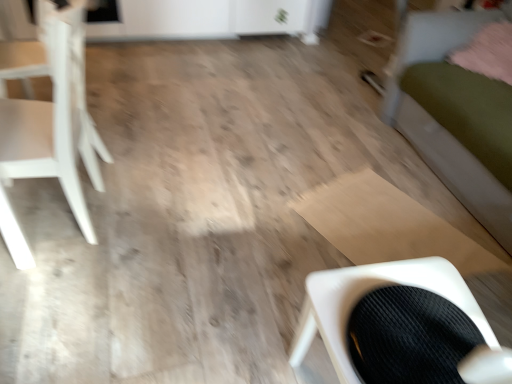
What are the coordinates of `free space above black corduroy chair at lower right, acting as the 1th chair starting from the bottom (from a real-world perspective)` in the screenshot? It's located at (418, 325).